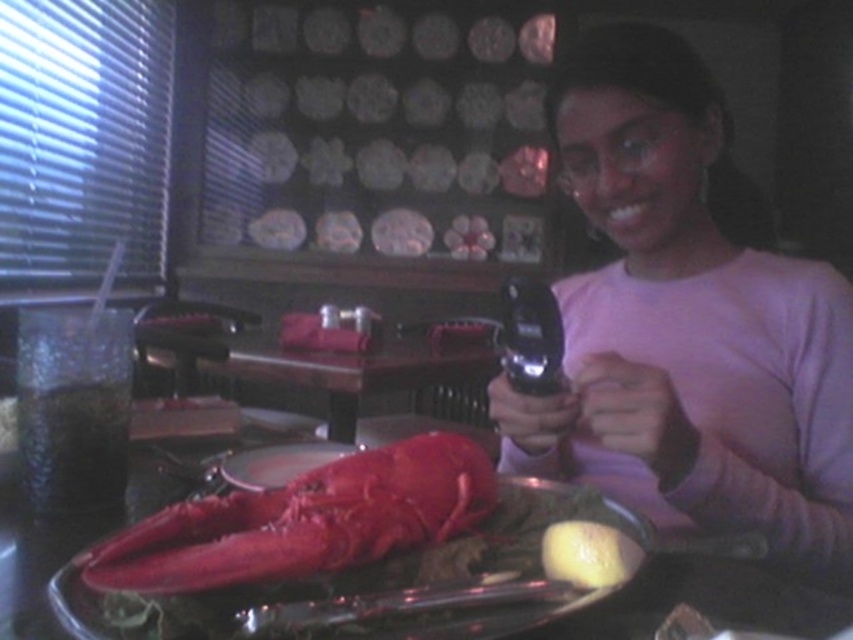
Question: Considering the real-world distances, which object is closest to the pink matte phone at upper right?

Choices:
 (A) shiny metal tray at center
 (B) shiny red lobster at center

Answer: (B)

Question: Can you confirm if pink matte phone at upper right is positioned to the left of shiny red lobster at center?

Choices:
 (A) no
 (B) yes

Answer: (A)

Question: Can you confirm if pink matte phone at upper right is thinner than shiny red lobster at center?

Choices:
 (A) no
 (B) yes

Answer: (A)

Question: Does shiny red lobster at center appear under yellow matte lemon at lower center?

Choices:
 (A) yes
 (B) no

Answer: (B)

Question: Which object is the farthest from the yellow matte lemon at lower center?

Choices:
 (A) pink matte phone at upper right
 (B) shiny red lobster at center
 (C) shiny metal tray at center

Answer: (C)

Question: Which point appears farthest from the camera in this image?

Choices:
 (A) (593, 532)
 (B) (343, 509)
 (C) (201, 436)
 (D) (584, 125)

Answer: (C)